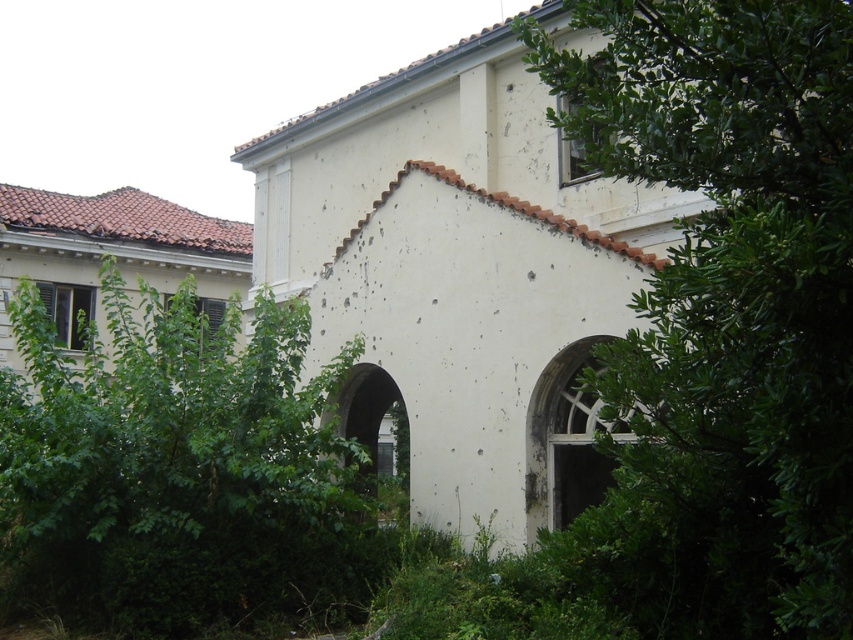
Question: Does green leafy tree at center right have a greater width compared to green leafy bush at lower left?

Choices:
 (A) yes
 (B) no

Answer: (B)

Question: Which of these objects is positioned farthest from the green leafy bush at lower left?

Choices:
 (A) white stone archway at center
 (B) green leafy tree at center right

Answer: (B)

Question: Observing the image, what is the correct spatial positioning of green leafy tree at center right in reference to white stone archway at center?

Choices:
 (A) above
 (B) below

Answer: (A)

Question: Is green leafy bush at lower left wider than white stone archway at center?

Choices:
 (A) yes
 (B) no

Answer: (A)

Question: Which object is farther from the camera taking this photo?

Choices:
 (A) green leafy bush at lower left
 (B) green leafy tree at center right

Answer: (A)

Question: Which object is the farthest from the green leafy bush at lower left?

Choices:
 (A) green leafy tree at center right
 (B) white stone archway at center

Answer: (A)